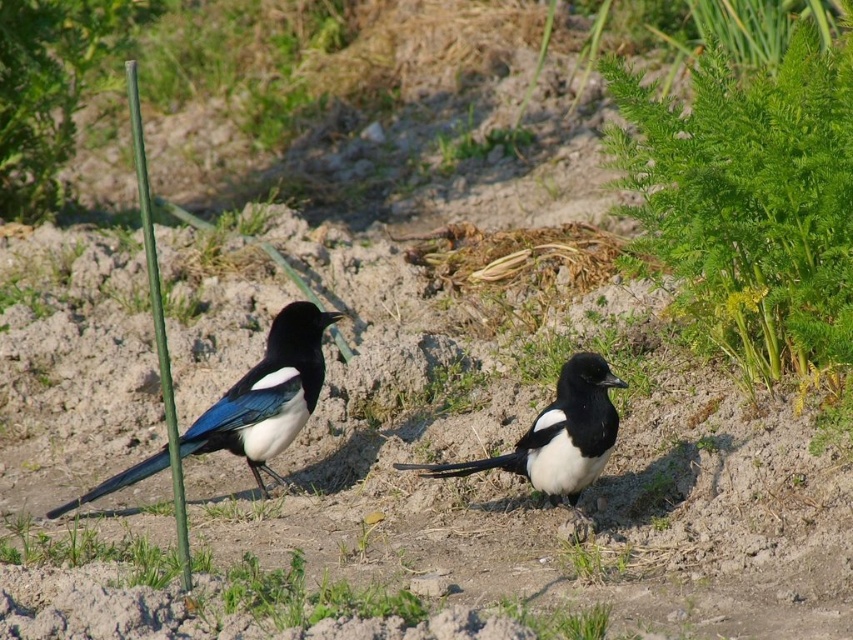
You are a birdwatcher trying to observe the shiny black and white magpie at left. There is green leafy grass at upper right in your line of sight. Can you see the magpie clearly?

The green leafy grass at upper right is in front of the shiny black and white magpie at left, so the grass may block your view of the magpie.

You are a birdwatcher trying to capture a photo of the white glossy magpie at center. You notice the green leafy grass at upper right might block your view. How far apart are these two objects?

The green leafy grass at upper right and white glossy magpie at center are 31.83 inches apart.